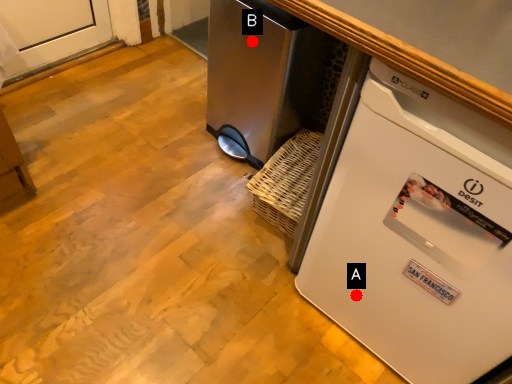
Question: Two points are circled on the image, labeled by A and B beside each circle. Which point is closer to the camera taking this photo?

Choices:
 (A) A is closer
 (B) B is closer

Answer: (A)